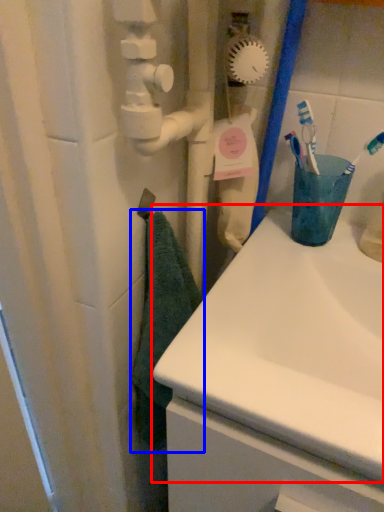
Question: Which of the following is the closest to the observer, sink (highlighted by a red box) or bath towel (highlighted by a blue box)?

Choices:
 (A) sink
 (B) bath towel

Answer: (A)